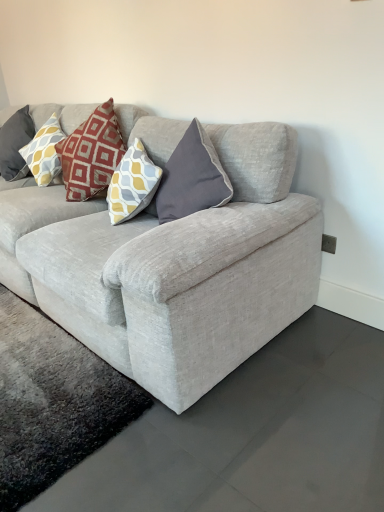
Question: Choose the correct answer: Is yellow and gray patterned pillow at upper left inside textured gray couch at center or outside it?

Choices:
 (A) inside
 (B) outside

Answer: (A)

Question: From the image's perspective, is yellow and gray patterned pillow at upper left positioned above or below textured gray couch at center?

Choices:
 (A) above
 (B) below

Answer: (A)

Question: From a real-world perspective, relative to textured gray couch at center, is yellow and gray patterned pillow at upper left vertically above or below?

Choices:
 (A) above
 (B) below

Answer: (A)

Question: Is textured gray couch at center bigger or smaller than yellow and gray patterned pillow at upper left?

Choices:
 (A) small
 (B) big

Answer: (B)

Question: Considering the relative positions of textured gray couch at center and yellow and gray patterned pillow at upper left in the image provided, is textured gray couch at center to the left or to the right of yellow and gray patterned pillow at upper left?

Choices:
 (A) left
 (B) right

Answer: (B)

Question: From a real-world perspective, is textured gray couch at center physically located above or below yellow and gray patterned pillow at upper left?

Choices:
 (A) above
 (B) below

Answer: (B)

Question: Considering the positions of textured gray couch at center and yellow and gray patterned pillow at upper left in the image, is textured gray couch at center wider or thinner than yellow and gray patterned pillow at upper left?

Choices:
 (A) wide
 (B) thin

Answer: (A)